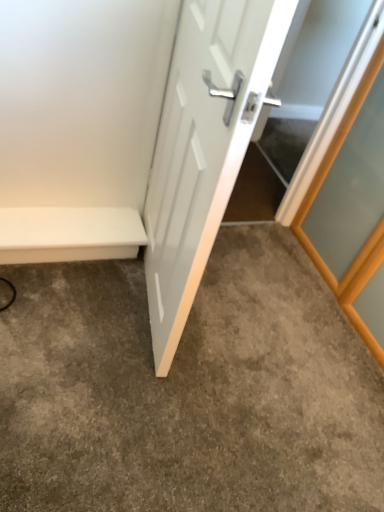
Locate an element on the screen. empty space that is ontop of gray carpet at center is located at coordinates (210, 359).